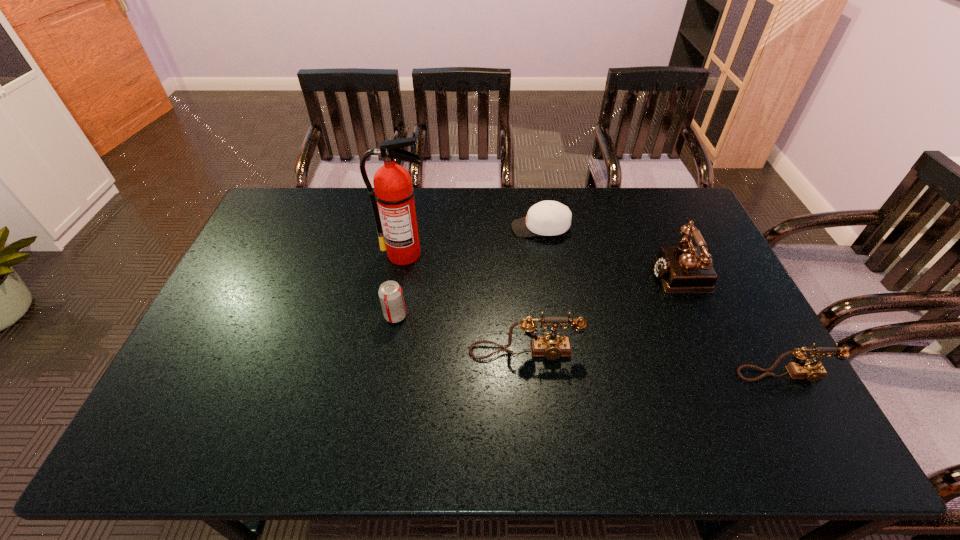
Find the location of `object present at the near right corner`. object present at the near right corner is located at coordinates (802, 368).

At what (x,y) coordinates should I click in order to perform the action: click on free spot at the far edge of the desktop. Please return your answer as a coordinate pair (x, y). Looking at the image, I should click on (627, 213).

The image size is (960, 540). In the image, there is a desktop. Find the location of `vacant space at the near edge`. vacant space at the near edge is located at coordinates (695, 382).

Where is `vacant space at the left edge of the desktop`? vacant space at the left edge of the desktop is located at coordinates (253, 342).

The image size is (960, 540). I want to click on vacant space at the right edge, so click(671, 235).

Where is `blank space at the far right corner of the desktop`? blank space at the far right corner of the desktop is located at coordinates (682, 202).

You are a GUI agent. You are given a task and a screenshot of the screen. Output one action in this format:
    pyautogui.click(x=<x>, y=<y>)
    Task: Click on the vacant area at the near right corner
    The height and width of the screenshot is (540, 960).
    Given the screenshot: What is the action you would take?
    pyautogui.click(x=775, y=387)

Where is `vacant space in between the fourth shortest object and the soda can`? This screenshot has height=540, width=960. vacant space in between the fourth shortest object and the soda can is located at coordinates (460, 334).

Where is `empty location between the tallest object and the fifth farthest object`? This screenshot has height=540, width=960. empty location between the tallest object and the fifth farthest object is located at coordinates [x=465, y=303].

Locate an element on the screen. The width and height of the screenshot is (960, 540). empty location between the leftmost telephone and the farthest object is located at coordinates (533, 290).